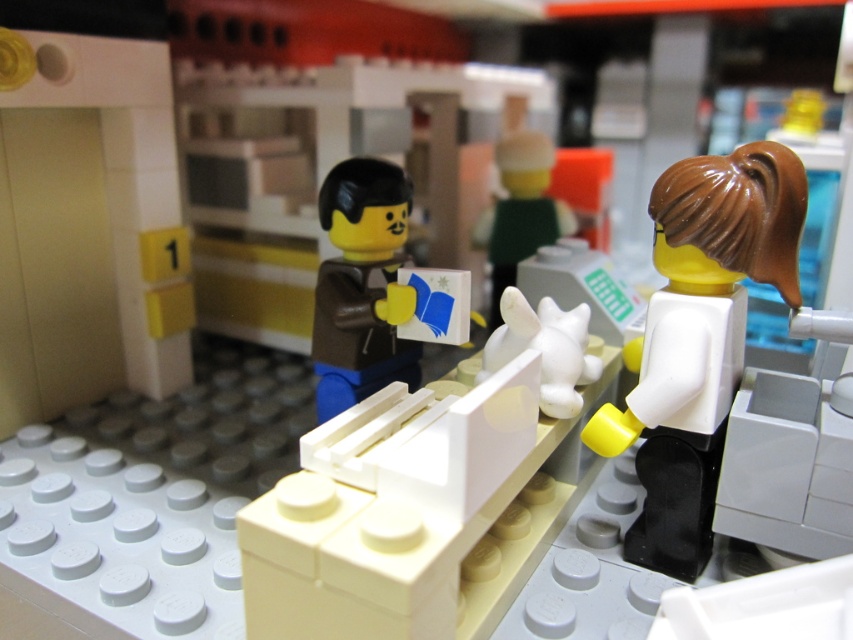
Can you confirm if white matte rabbit at center is shorter than white matte cat at center?

No.

Locate an element on the screen. Image resolution: width=853 pixels, height=640 pixels. white matte rabbit at center is located at coordinates (520, 211).

Which is behind, point (488, 241) or point (548, 358)?

Point (488, 241)

This screenshot has width=853, height=640. I want to click on white matte rabbit at center, so click(x=520, y=211).

Can you confirm if white matte figure at right is positioned above brown matte jacket at center?

No.

At what (x,y) coordinates should I click in order to perform the action: click on white matte figure at right. Please return your answer as a coordinate pair (x, y). The height and width of the screenshot is (640, 853). Looking at the image, I should click on (700, 337).

This screenshot has width=853, height=640. In order to click on white matte figure at right in this screenshot , I will do `click(700, 337)`.

Image resolution: width=853 pixels, height=640 pixels. Describe the element at coordinates (360, 284) in the screenshot. I see `brown matte jacket at center` at that location.

Looking at this image, who is lower down, brown matte jacket at center or white matte rabbit at center?

brown matte jacket at center is below.

Who is more forward, (x=396, y=353) or (x=538, y=154)?

Point (x=396, y=353) is more forward.

Identify the location of brown matte jacket at center. (360, 284).